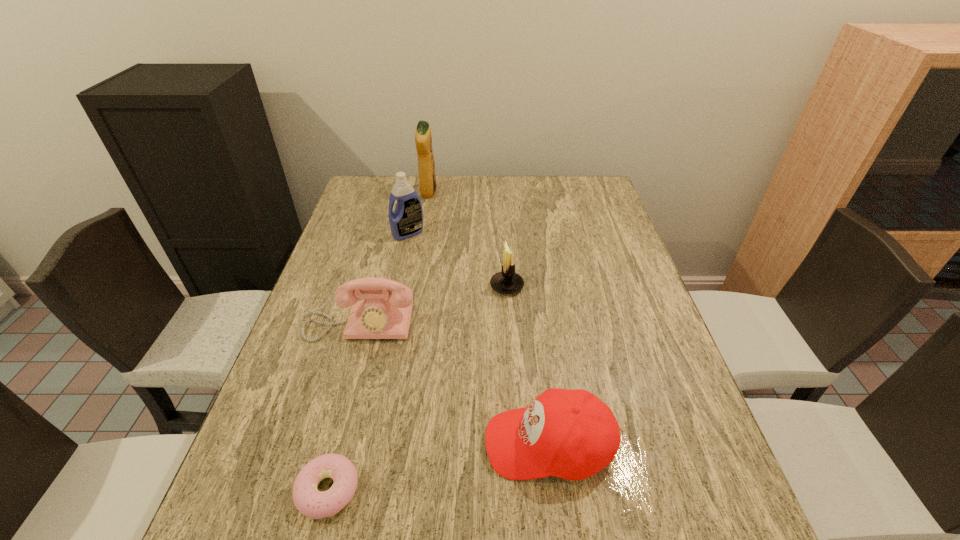
At what (x,y) coordinates should I click in order to perform the action: click on blank space at the left edge. Please return your answer as a coordinate pair (x, y). This screenshot has height=540, width=960. Looking at the image, I should click on (305, 401).

The width and height of the screenshot is (960, 540). I want to click on vacant space at the right edge of the desktop, so click(619, 323).

At what (x,y) coordinates should I click in order to perform the action: click on free space at the far right corner. Please return your answer as a coordinate pair (x, y). Looking at the image, I should click on (565, 190).

Locate an element on the screen. This screenshot has height=540, width=960. empty space between the shortest object and the farthest object is located at coordinates (378, 341).

I want to click on unoccupied position between the doughnut and the fifth nearest object, so click(x=368, y=361).

At what (x,y) coordinates should I click in order to perform the action: click on free spot between the baseball cap and the third nearest object. Please return your answer as a coordinate pair (x, y). The image size is (960, 540). Looking at the image, I should click on (454, 383).

The image size is (960, 540). I want to click on unoccupied position between the candle holder and the second shortest object, so click(x=528, y=364).

Locate an element on the screen. Image resolution: width=960 pixels, height=540 pixels. free point between the telephone and the shortest object is located at coordinates (344, 407).

You are a GUI agent. You are given a task and a screenshot of the screen. Output one action in this format:
    pyautogui.click(x=<x>, y=<y>)
    Task: Click on the free area in between the fourth farthest object and the fourth nearest object
    This screenshot has width=960, height=540.
    Given the screenshot: What is the action you would take?
    pyautogui.click(x=433, y=305)

Find the location of a particular element. Image resolution: width=960 pixels, height=540 pixels. vacant space that's between the shortest object and the baseball cap is located at coordinates (438, 467).